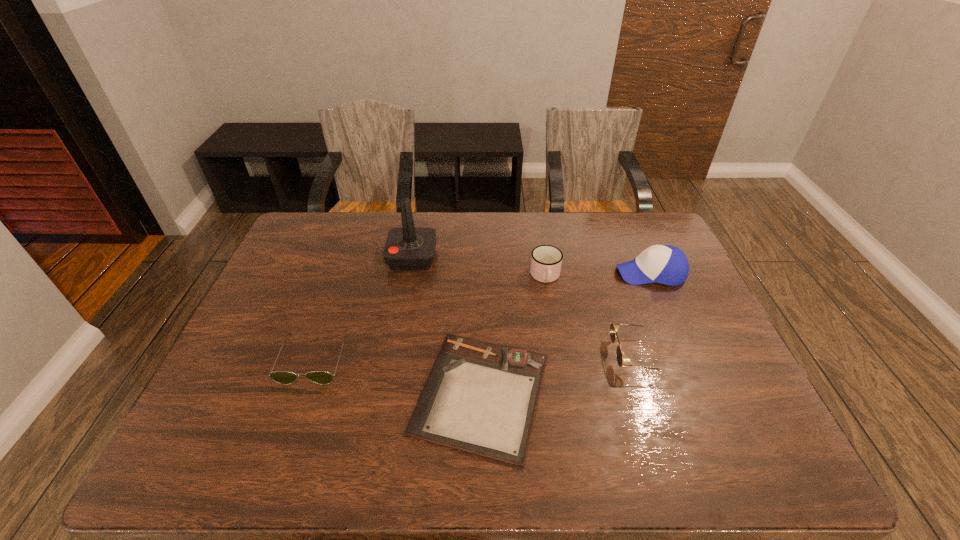
I want to click on joystick, so click(x=408, y=248).

I want to click on the fifth shortest object, so click(x=665, y=264).

Locate an element on the screen. The image size is (960, 540). mug is located at coordinates (x=546, y=260).

Locate an element on the screen. Image resolution: width=960 pixels, height=540 pixels. the right sunglasses is located at coordinates (614, 327).

Find the location of a particular element. The height and width of the screenshot is (540, 960). the leftmost object is located at coordinates (282, 377).

Find the location of a particular element. Image resolution: width=960 pixels, height=540 pixels. the fifth tallest object is located at coordinates (282, 377).

Image resolution: width=960 pixels, height=540 pixels. Find the location of `the shortest object`. the shortest object is located at coordinates (480, 397).

At what (x,y) coordinates should I click in order to perform the action: click on vacant region located on the front of the tallest object. Please return your answer as a coordinate pair (x, y). This screenshot has height=540, width=960. Looking at the image, I should click on (403, 307).

Locate an element on the screen. Image resolution: width=960 pixels, height=540 pixels. free space located 0.160m on the front-facing side of the baseball cap is located at coordinates (565, 273).

At what (x,y) coordinates should I click in order to perform the action: click on vacant space located 0.170m on the front-facing side of the baseball cap. Please return your answer as a coordinate pair (x, y). Image resolution: width=960 pixels, height=540 pixels. Looking at the image, I should click on (562, 273).